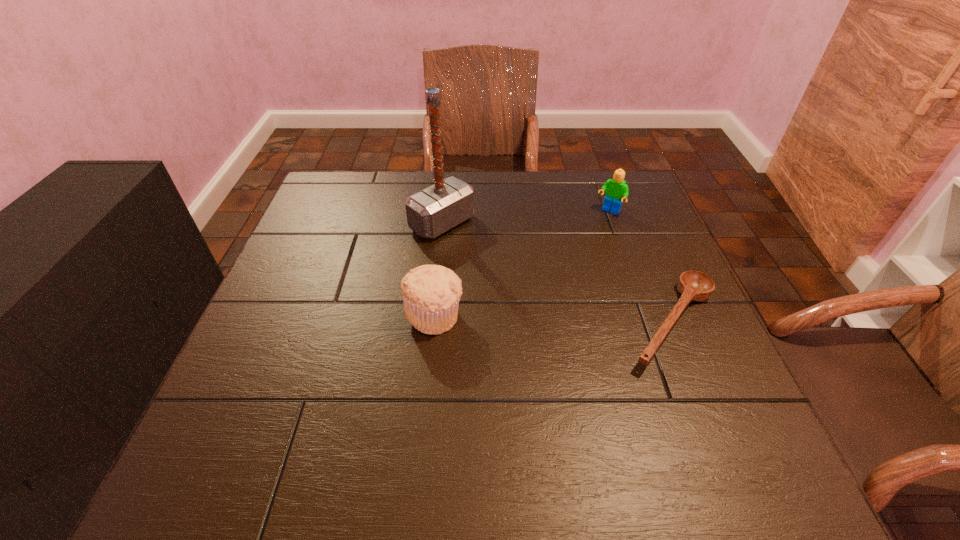
This screenshot has width=960, height=540. I want to click on free point located 0.310m on the face of the Lego, so click(x=550, y=284).

Where is `free space located 0.070m on the face of the Lego`? This screenshot has width=960, height=540. free space located 0.070m on the face of the Lego is located at coordinates tap(593, 231).

Identify the location of hammer that is at the far edge. (432, 211).

This screenshot has width=960, height=540. Find the location of `Lego that is at the far edge`. Lego that is at the far edge is located at coordinates (616, 189).

You are a GUI agent. You are given a task and a screenshot of the screen. Output one action in this format:
    pyautogui.click(x=<x>, y=<y>)
    Task: Click on the wooden spoon that is at the right edge
    This screenshot has height=540, width=960.
    Given the screenshot: What is the action you would take?
    pyautogui.click(x=693, y=285)

Find the location of a particular element. This screenshot has width=960, height=540. Lego that is positioned at the right edge is located at coordinates (616, 189).

Where is `object present at the far right corner`? The width and height of the screenshot is (960, 540). object present at the far right corner is located at coordinates (616, 189).

Where is `free space at the far edge`? free space at the far edge is located at coordinates tap(492, 217).

In order to click on vacant area at the near edge of the desktop in this screenshot , I will do `click(516, 395)`.

Where is `free spot at the left edge of the desktop`? The height and width of the screenshot is (540, 960). free spot at the left edge of the desktop is located at coordinates (263, 378).